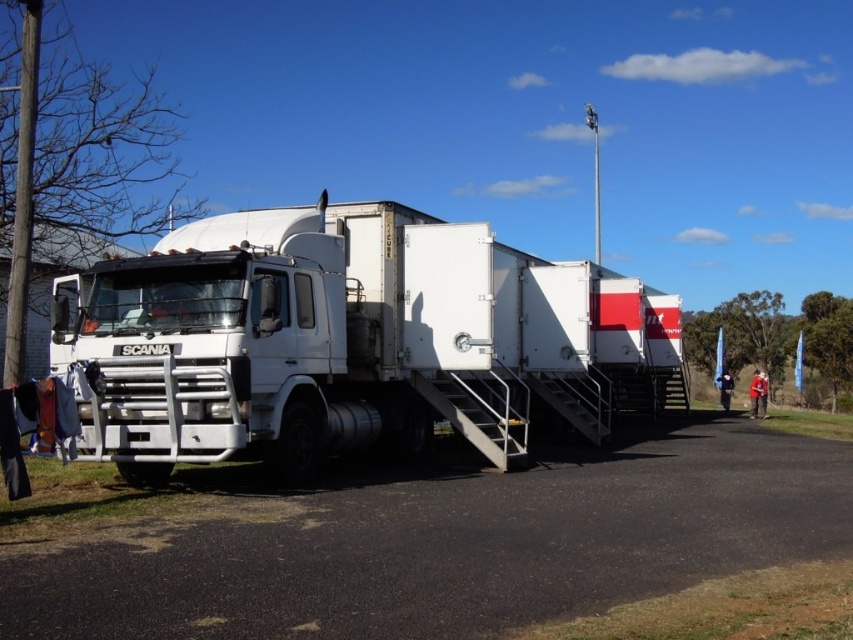
Between white matte trailer truck at center and black asphalt at lower center, which one is positioned higher?

white matte trailer truck at center

Who is positioned more to the left, white matte trailer truck at center or black asphalt at lower center?

Positioned to the left is white matte trailer truck at center.

What do you see at coordinates (347, 339) in the screenshot?
I see `white matte trailer truck at center` at bounding box center [347, 339].

Image resolution: width=853 pixels, height=640 pixels. Find the location of `white matte trailer truck at center`. white matte trailer truck at center is located at coordinates (347, 339).